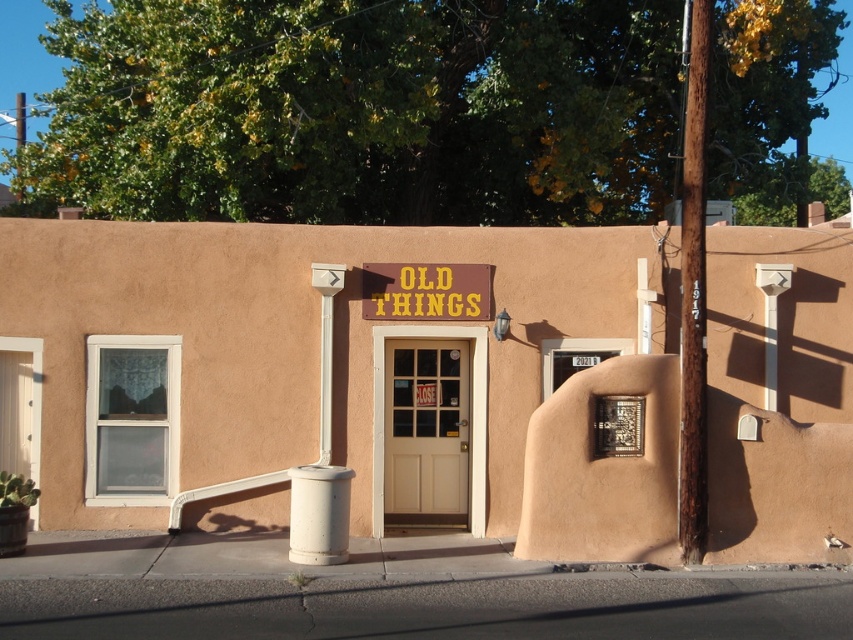
Question: Among these points, which one is farthest from the camera?

Choices:
 (A) (416, 312)
 (B) (456, 449)

Answer: (B)

Question: Is white wood door at center wider than brown wooden sign at center?

Choices:
 (A) yes
 (B) no

Answer: (B)

Question: Which is nearer to the brown wooden sign at center?

Choices:
 (A) matte beige building at center
 (B) white wood door at center

Answer: (B)

Question: Considering the real-world distances, which object is farthest from the matte beige building at center?

Choices:
 (A) brown wooden sign at center
 (B) white wood door at center

Answer: (B)

Question: Is matte beige building at center wider than brown wooden sign at center?

Choices:
 (A) no
 (B) yes

Answer: (A)

Question: Does matte beige building at center have a greater width compared to brown wooden sign at center?

Choices:
 (A) yes
 (B) no

Answer: (B)